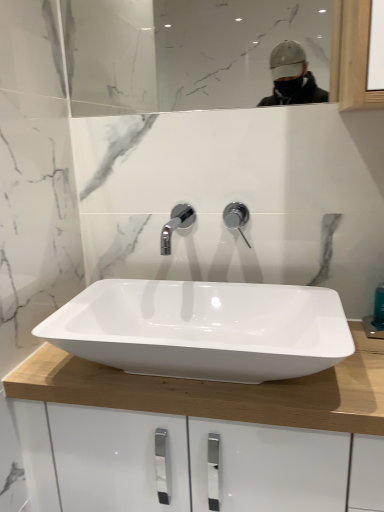
Question: Considering the relative sizes of polished chrome tap at center and clear glass mirror at upper center in the image provided, is polished chrome tap at center bigger than clear glass mirror at upper center?

Choices:
 (A) no
 (B) yes

Answer: (A)

Question: From the image's perspective, is polished chrome tap at center above clear glass mirror at upper center?

Choices:
 (A) yes
 (B) no

Answer: (B)

Question: Does polished chrome tap at center have a lesser width compared to clear glass mirror at upper center?

Choices:
 (A) no
 (B) yes

Answer: (A)

Question: Can you confirm if polished chrome tap at center is shorter than clear glass mirror at upper center?

Choices:
 (A) yes
 (B) no

Answer: (A)

Question: Is polished chrome tap at center positioned before clear glass mirror at upper center?

Choices:
 (A) no
 (B) yes

Answer: (A)

Question: Can we say polished chrome tap at center lies outside clear glass mirror at upper center?

Choices:
 (A) yes
 (B) no

Answer: (A)

Question: Can we say clear glass mirror at upper center lies outside polished chrome tap at center?

Choices:
 (A) yes
 (B) no

Answer: (A)

Question: Is the position of clear glass mirror at upper center more distant than that of polished chrome tap at center?

Choices:
 (A) no
 (B) yes

Answer: (A)

Question: Is clear glass mirror at upper center wider than polished chrome tap at center?

Choices:
 (A) yes
 (B) no

Answer: (B)

Question: Considering the relative sizes of clear glass mirror at upper center and polished chrome tap at center in the image provided, is clear glass mirror at upper center bigger than polished chrome tap at center?

Choices:
 (A) no
 (B) yes

Answer: (B)

Question: Does clear glass mirror at upper center have a lesser height compared to polished chrome tap at center?

Choices:
 (A) yes
 (B) no

Answer: (B)

Question: From a real-world perspective, is clear glass mirror at upper center located higher than polished chrome tap at center?

Choices:
 (A) yes
 (B) no

Answer: (A)

Question: Can you confirm if clear glass mirror at upper center is shorter than white glossy sink at center?

Choices:
 (A) yes
 (B) no

Answer: (B)